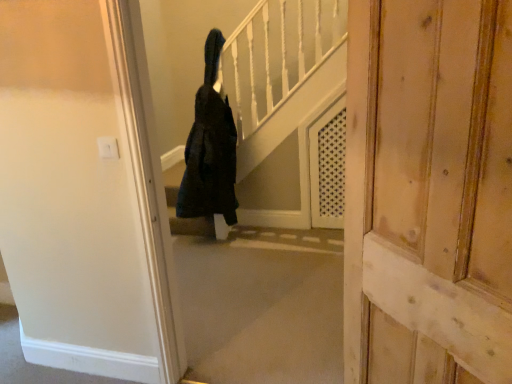
Question: Can you confirm if black fuzzy coat at center is thinner than wooden door at center?

Choices:
 (A) no
 (B) yes

Answer: (A)

Question: From the image's perspective, does black fuzzy coat at center appear higher than wooden door at center?

Choices:
 (A) no
 (B) yes

Answer: (B)

Question: Would you say wooden door at center is part of black fuzzy coat at center's contents?

Choices:
 (A) no
 (B) yes

Answer: (A)

Question: Is black fuzzy coat at center to the left of wooden door at center from the viewer's perspective?

Choices:
 (A) no
 (B) yes

Answer: (B)

Question: Considering the relative positions of black fuzzy coat at center and wooden door at center in the image provided, is black fuzzy coat at center to the right of wooden door at center from the viewer's perspective?

Choices:
 (A) no
 (B) yes

Answer: (A)

Question: Is black fuzzy coat at center smaller than wooden door at center?

Choices:
 (A) yes
 (B) no

Answer: (A)

Question: Is there a large distance between wooden door at center and black fuzzy coat at center?

Choices:
 (A) no
 (B) yes

Answer: (B)

Question: Can you see wooden door at center touching black fuzzy coat at center?

Choices:
 (A) yes
 (B) no

Answer: (B)

Question: Does wooden door at center have a greater width compared to black fuzzy coat at center?

Choices:
 (A) no
 (B) yes

Answer: (A)

Question: From a real-world perspective, does wooden door at center sit lower than black fuzzy coat at center?

Choices:
 (A) yes
 (B) no

Answer: (B)

Question: Is wooden door at center to the right of black fuzzy coat at center from the viewer's perspective?

Choices:
 (A) yes
 (B) no

Answer: (A)

Question: Considering the relative positions of wooden door at center and black fuzzy coat at center in the image provided, is wooden door at center behind black fuzzy coat at center?

Choices:
 (A) yes
 (B) no

Answer: (B)

Question: In terms of width, does wooden door at center look wider or thinner when compared to black fuzzy coat at center?

Choices:
 (A) thin
 (B) wide

Answer: (A)